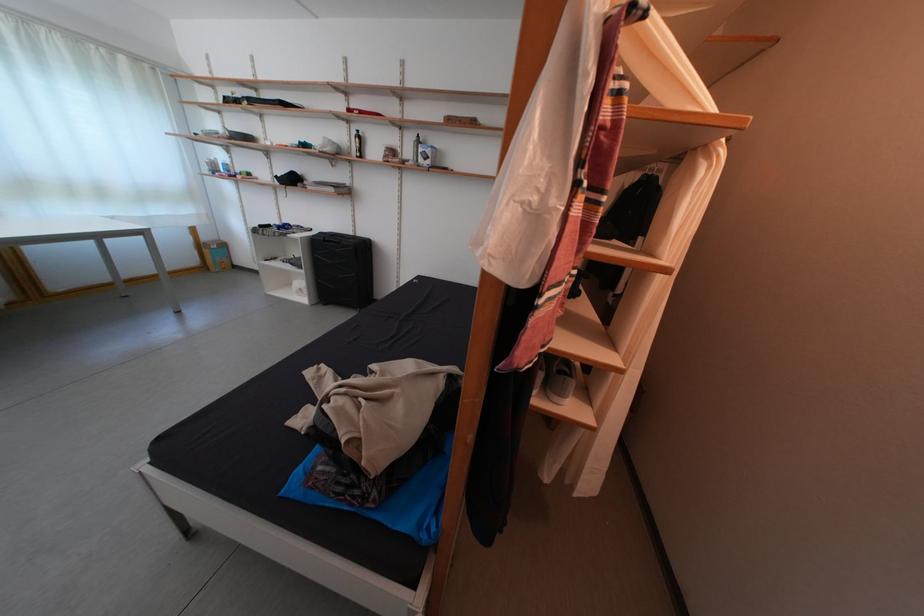
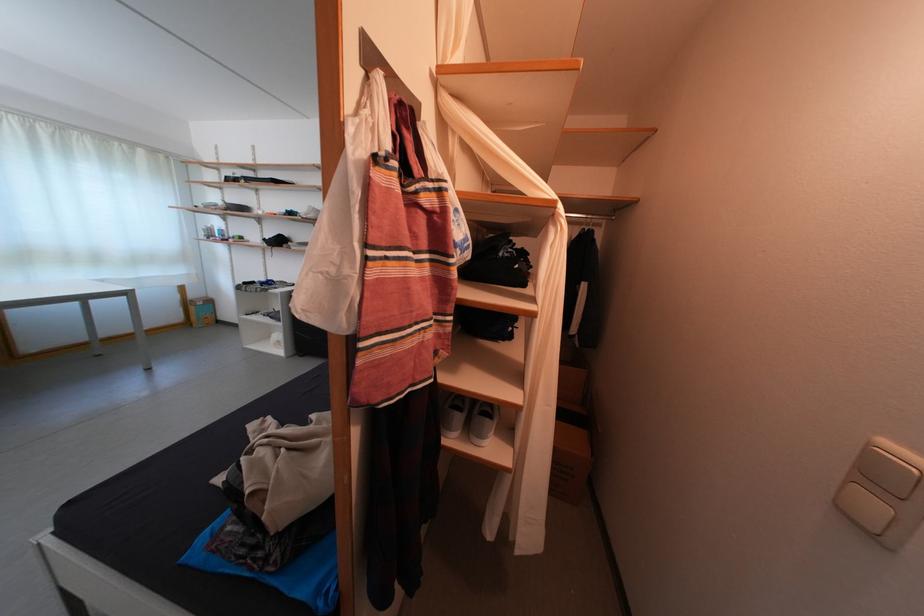
Locate, in the second image, the point that corresponds to pixel 572 215 in the first image.

(366, 282)